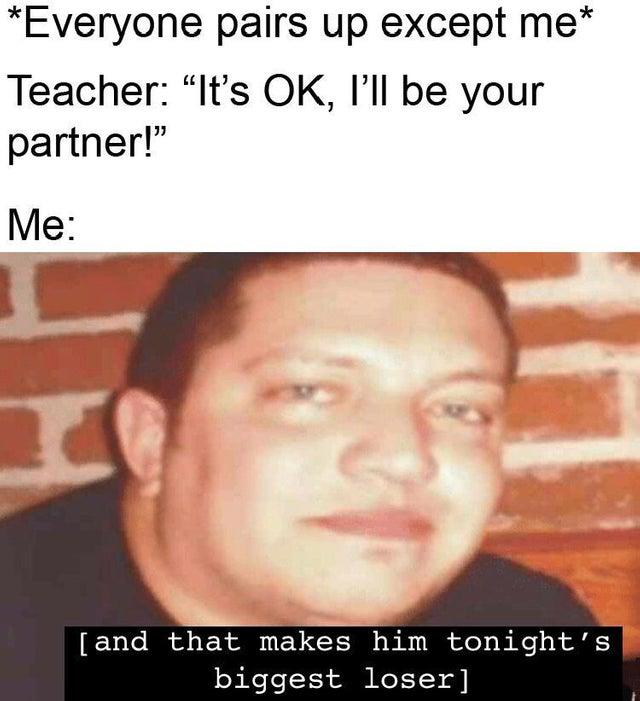
At what (x,y) coordinates should I click in order to perform the action: click on brick wall. Please return your answer as a coordinate pair (x, y). This screenshot has width=640, height=701. Looking at the image, I should click on (540, 488).